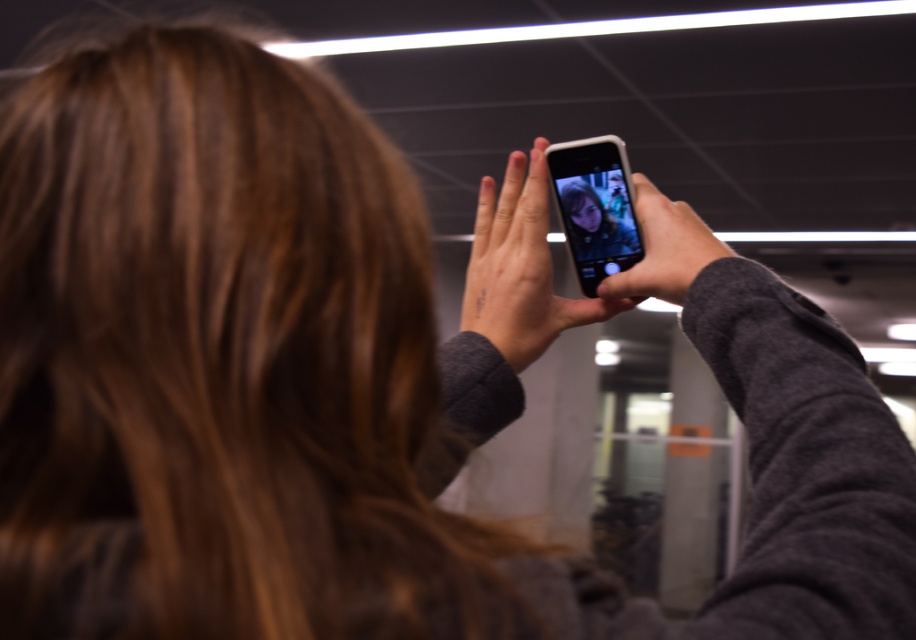
You are a photographer trying to choose between two phones in the scene to capture a detailed shot. The scene shows a satin black phone at upper center and a matte black phone at upper center. Which phone should you pick if you want the larger one for better grip?

The satin black phone at upper center is larger in size than the matte black phone at upper center, so you should pick the satin black phone at upper center for better grip.

You are a photographer trying to capture a clear image of the phone in the foreground. Which phone, the satin black phone at upper center or the matte black phone at upper center, is closer to you?

The satin black phone at upper center is closer to you because it is further to the viewer than the matte black phone at upper center.

You are a photographer trying to choose between two phones in the image to take a clearer photo. The satin black phone at upper center and the matte black phone at upper center are both options. Which phone is taller and might have a larger screen for better framing?

The satin black phone at upper center is taller than the matte black phone at upper center, so it might have a larger screen for better framing.